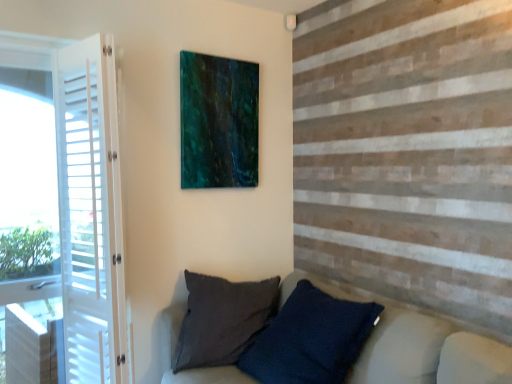
Question: Considering the relative sizes of dark blue textured pillow at lower center and teal glossy painting at upper center in the image provided, is dark blue textured pillow at lower center thinner than teal glossy painting at upper center?

Choices:
 (A) yes
 (B) no

Answer: (B)

Question: From the image's perspective, does dark blue textured pillow at lower center appear lower than teal glossy painting at upper center?

Choices:
 (A) yes
 (B) no

Answer: (A)

Question: From the image's perspective, is dark blue textured pillow at lower center over teal glossy painting at upper center?

Choices:
 (A) no
 (B) yes

Answer: (A)

Question: From a real-world perspective, is dark blue textured pillow at lower center below teal glossy painting at upper center?

Choices:
 (A) yes
 (B) no

Answer: (A)

Question: Can you confirm if dark blue textured pillow at lower center is bigger than teal glossy painting at upper center?

Choices:
 (A) yes
 (B) no

Answer: (A)

Question: Does dark blue textured pillow at lower center have a greater width compared to teal glossy painting at upper center?

Choices:
 (A) no
 (B) yes

Answer: (B)

Question: Is teal glossy painting at upper center thinner than dark blue textured pillow at lower center?

Choices:
 (A) no
 (B) yes

Answer: (B)

Question: Is teal glossy painting at upper center positioned far away from dark blue textured pillow at lower center?

Choices:
 (A) no
 (B) yes

Answer: (B)

Question: Is teal glossy painting at upper center facing towards dark blue textured pillow at lower center?

Choices:
 (A) yes
 (B) no

Answer: (B)

Question: Is teal glossy painting at upper center in front of dark blue textured pillow at lower center?

Choices:
 (A) yes
 (B) no

Answer: (B)

Question: Does teal glossy painting at upper center have a greater width compared to dark blue textured pillow at lower center?

Choices:
 (A) yes
 (B) no

Answer: (B)

Question: From a real-world perspective, is teal glossy painting at upper center physically below dark blue textured pillow at lower center?

Choices:
 (A) yes
 (B) no

Answer: (B)

Question: Is teal glossy painting at upper center positioned with its back to white wood screen door at left?

Choices:
 (A) no
 (B) yes

Answer: (A)